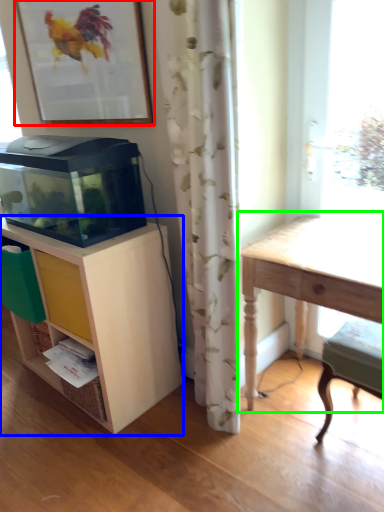
Question: Estimate the real-world distances between objects in this image. Which object is closer to picture frame (highlighted by a red box), shelf (highlighted by a blue box) or table (highlighted by a green box)?

Choices:
 (A) shelf
 (B) table

Answer: (A)